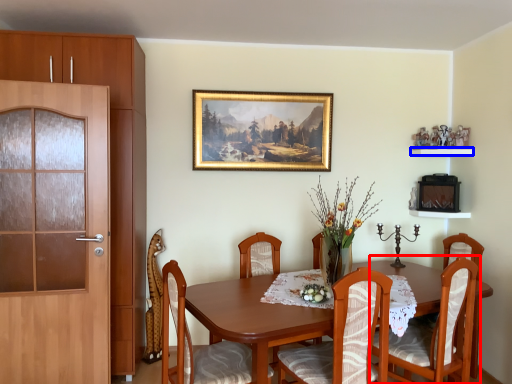
Question: Which object is closer to the camera taking this photo, chair (highlighted by a red box) or shelf (highlighted by a blue box)?

Choices:
 (A) chair
 (B) shelf

Answer: (A)